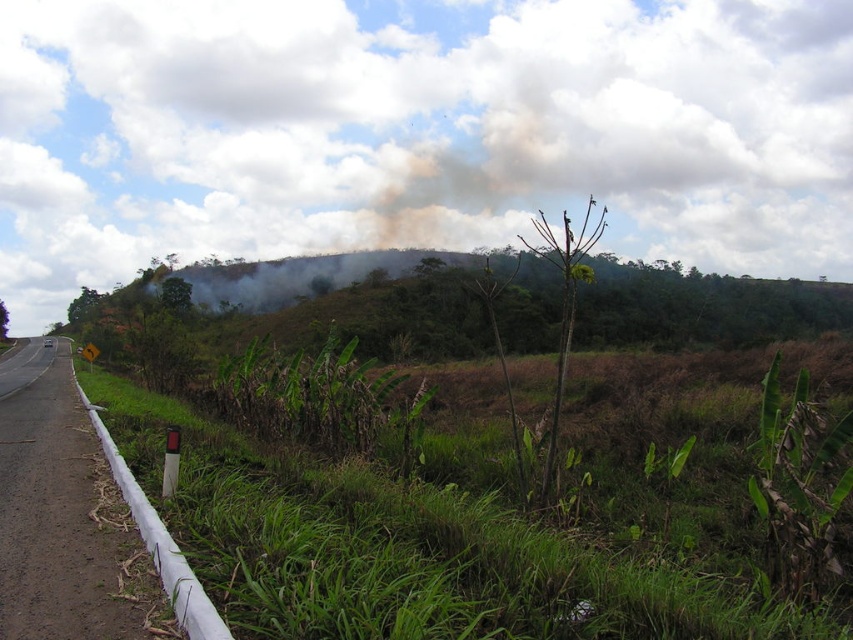
Question: Which of the following is the closest to the observer?

Choices:
 (A) white plastic barrier at left
 (B) green leafy vegetation at center

Answer: (A)

Question: Which point is closer to the camera?

Choices:
 (A) green leafy vegetation at center
 (B) white plastic barrier at left

Answer: (B)

Question: Does green leafy vegetation at center appear on the right side of white plastic barrier at left?

Choices:
 (A) no
 (B) yes

Answer: (B)

Question: Which of the following is the farthest from the observer?

Choices:
 (A) (741, 608)
 (B) (138, 554)

Answer: (A)

Question: Is green leafy vegetation at center to the left of white plastic barrier at left from the viewer's perspective?

Choices:
 (A) yes
 (B) no

Answer: (B)

Question: Considering the relative positions of green leafy vegetation at center and white plastic barrier at left in the image provided, where is green leafy vegetation at center located with respect to white plastic barrier at left?

Choices:
 (A) right
 (B) left

Answer: (A)